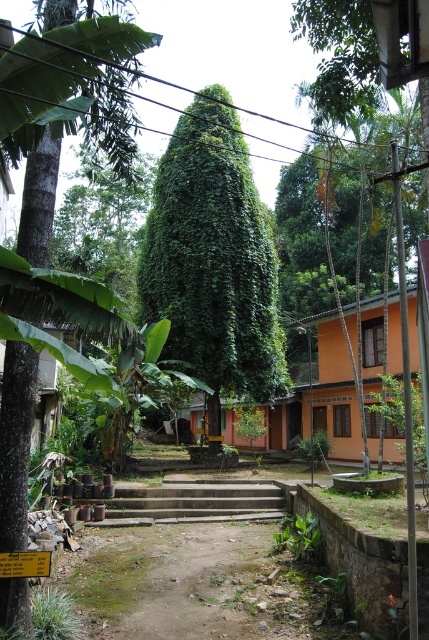
Can you confirm if green leafy tree at center is wider than concrete stairs at center?

Yes, green leafy tree at center is wider than concrete stairs at center.

Between green leafy tree at center and concrete stairs at center, which one appears on the right side from the viewer's perspective?

Positioned to the right is concrete stairs at center.

Who is more distant from viewer, (x=217, y=221) or (x=168, y=486)?

Point (x=217, y=221)

Find the location of a particular element. The height and width of the screenshot is (640, 429). green leafy tree at center is located at coordinates (213, 260).

Who is higher up, green leafy tree at center or green leafy tree at left?

green leafy tree at center is higher up.

Is green leafy tree at center shorter than green leafy tree at left?

Incorrect, green leafy tree at center's height does not fall short of green leafy tree at left's.

Between point (232, 205) and point (2, 493), which one is positioned behind?

The point (232, 205) is more distant.

Image resolution: width=429 pixels, height=640 pixels. In order to click on green leafy tree at center in this screenshot , I will do `click(213, 260)`.

What do you see at coordinates (15, 442) in the screenshot? This screenshot has height=640, width=429. I see `green leafy tree at left` at bounding box center [15, 442].

Between point (27, 196) and point (141, 492), which one is positioned in front?

Point (27, 196)

Is point (18, 602) closer to camera compared to point (278, 488)?

That is True.

At what (x,y) coordinates should I click in order to perform the action: click on green leafy tree at left. Please return your answer as a coordinate pair (x, y). This screenshot has height=640, width=429. Looking at the image, I should click on (15, 442).